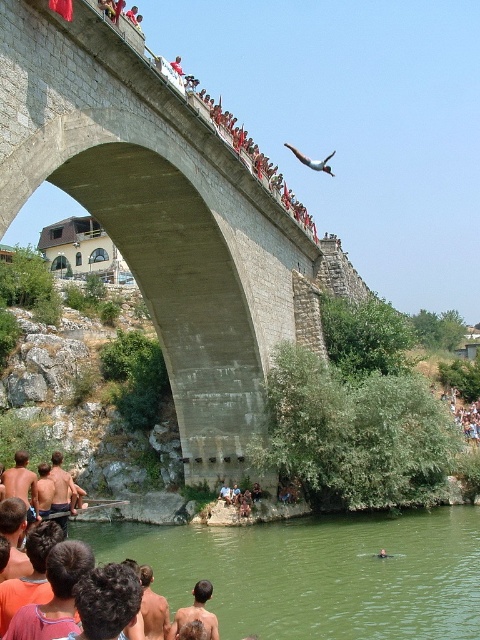
Question: Considering the real-world distances, which object is farthest from the concrete bridge at center?

Choices:
 (A) smooth white airplane at upper center
 (B) green water at lower center

Answer: (A)

Question: Where is green water at lower center located in relation to brown hair at lower center in the image?

Choices:
 (A) above
 (B) below

Answer: (B)

Question: Which point appears farthest from the camera in this image?

Choices:
 (A) tap(105, 524)
 (B) tap(289, 145)
 (C) tap(192, 614)
 (D) tap(8, 195)

Answer: (B)

Question: Is brown hair at lower center wider than blue denim shorts at lower center?

Choices:
 (A) yes
 (B) no

Answer: (A)

Question: Based on their relative distances, which object is nearer to the concrete bridge at center?

Choices:
 (A) brown hair at lower center
 (B) smooth white airplane at upper center

Answer: (A)

Question: Where is green water at lower center located in relation to blue denim shorts at lower center in the image?

Choices:
 (A) below
 (B) above

Answer: (A)